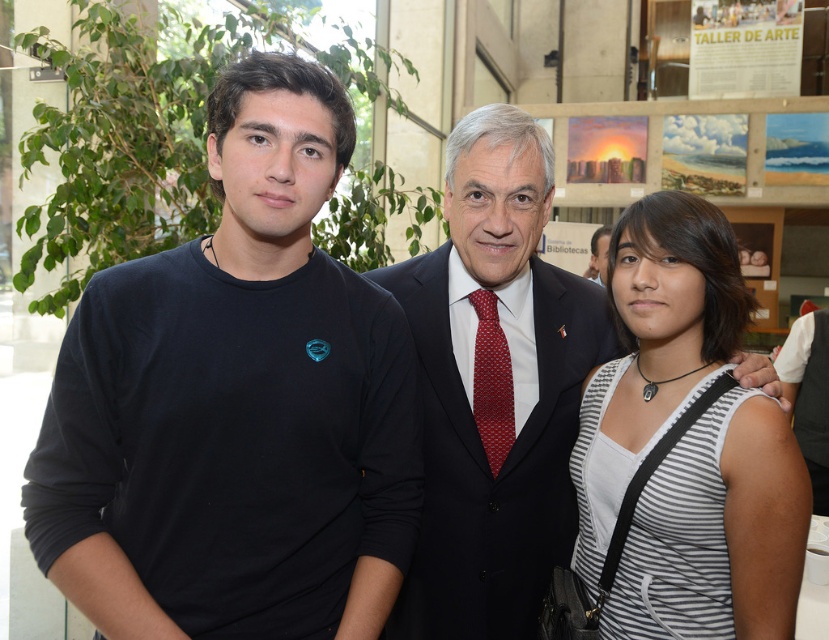
Question: Is white striped tank top at right wider than red textured tie at center?

Choices:
 (A) yes
 (B) no

Answer: (A)

Question: Is black matte shirt at left below matte black suit at center?

Choices:
 (A) no
 (B) yes

Answer: (B)

Question: Which point is closer to the camera taking this photo?

Choices:
 (A) (720, 243)
 (B) (75, 342)
 (C) (487, 305)
 (D) (478, 451)

Answer: (B)

Question: Which point is farther to the camera?

Choices:
 (A) (398, 630)
 (B) (482, 422)
 (C) (71, 404)

Answer: (A)

Question: Which point is farther from the camera taking this photo?

Choices:
 (A) (710, 419)
 (B) (483, 433)

Answer: (B)

Question: Is black matte shirt at left to the right of matte black suit at center from the viewer's perspective?

Choices:
 (A) no
 (B) yes

Answer: (A)